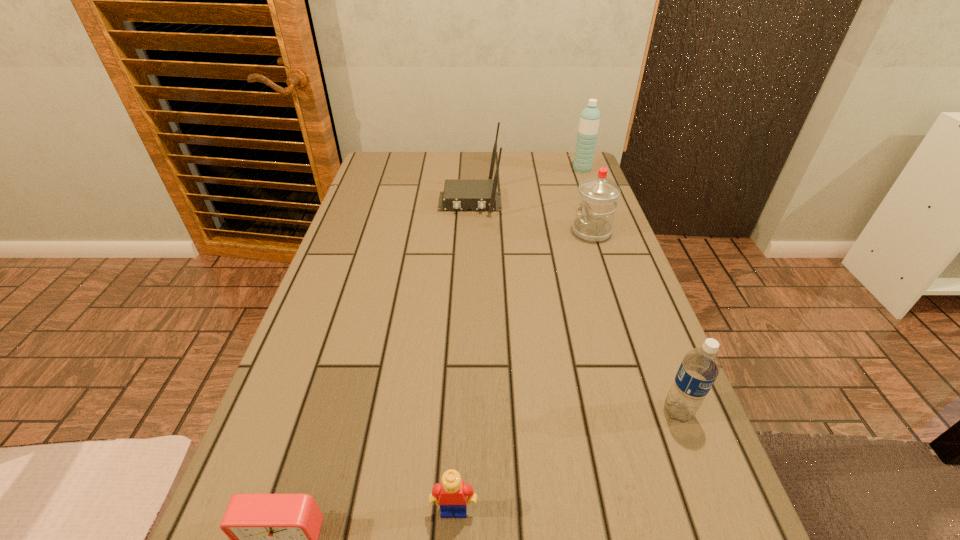
Find the location of a particular element. free location that satisfies the following two spatial constraints: 1. on the front side of the nearest water bottle; 2. on the left side of the farthest object is located at coordinates (671, 411).

Where is `vacant space that satisfies the following two spatial constraints: 1. on the back of the fifth nearest object to connect cables; 2. on the right side of the third nearest object`? The height and width of the screenshot is (540, 960). vacant space that satisfies the following two spatial constraints: 1. on the back of the fifth nearest object to connect cables; 2. on the right side of the third nearest object is located at coordinates (463, 411).